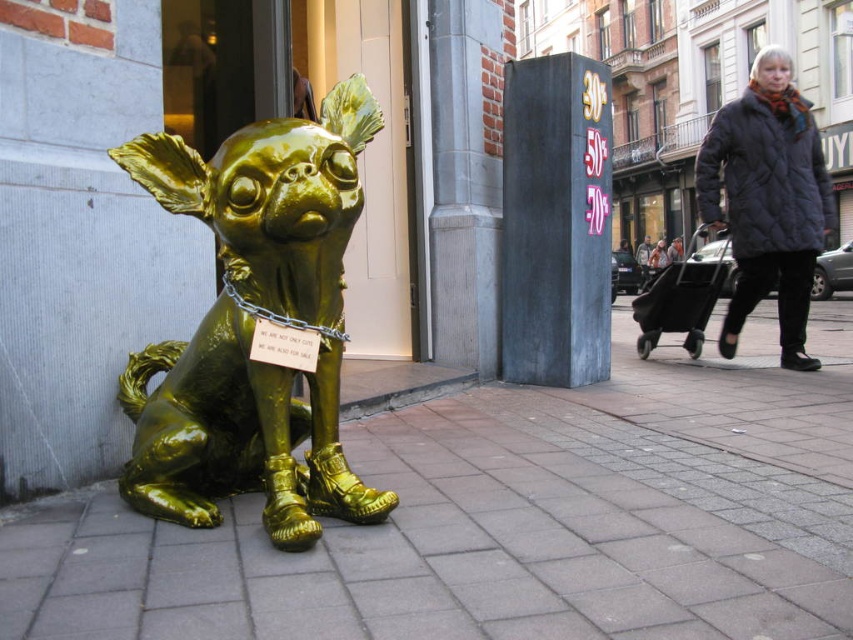
Does glossy pavement at lower center lie behind glossy gold dog at left?

No, glossy pavement at lower center is in front of glossy gold dog at left.

Consider the image. Is glossy pavement at lower center above glossy gold dog at left?

No.

What do you see at coordinates (509, 518) in the screenshot? I see `glossy pavement at lower center` at bounding box center [509, 518].

Locate an element on the screen. This screenshot has width=853, height=640. glossy pavement at lower center is located at coordinates (509, 518).

Who is more distant from viewer, [756,488] or [253,307]?

Positioned behind is point [756,488].

Between glossy pavement at lower center and gold metallic chain at center, which one appears on the left side from the viewer's perspective?

gold metallic chain at center

At what (x,y) coordinates should I click in order to perform the action: click on glossy pavement at lower center. Please return your answer as a coordinate pair (x, y). This screenshot has height=640, width=853. Looking at the image, I should click on (509, 518).

Is point (144, 536) more distant than point (779, 100)?

No.

Does point (611, 522) lie in front of point (752, 81)?

Yes.

Which is behind, point (624, 436) or point (782, 145)?

The point (782, 145) is behind.

Where is `glossy pavement at lower center`? The image size is (853, 640). glossy pavement at lower center is located at coordinates (509, 518).